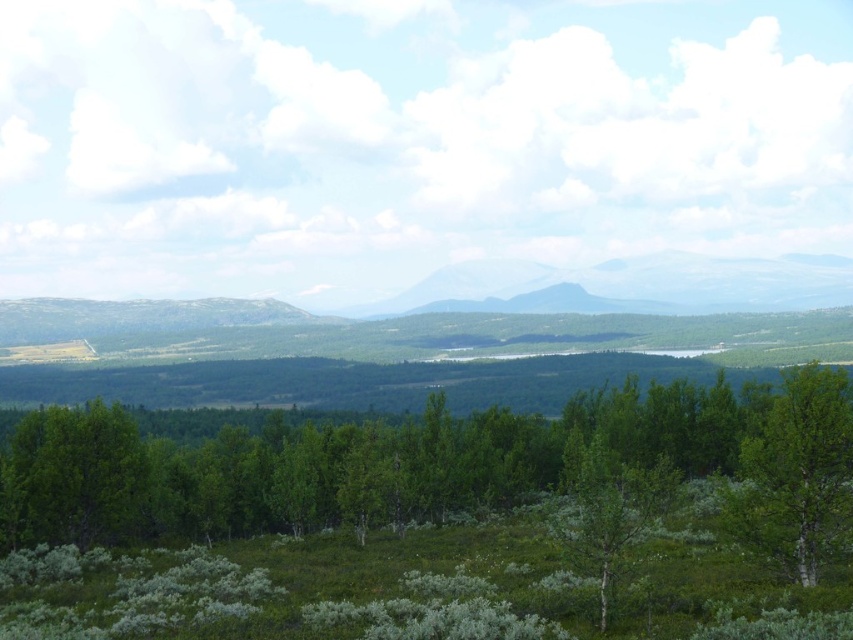
Question: Considering the relative positions of green leafy tree at right and green leafy tree at lower left in the image provided, where is green leafy tree at right located with respect to green leafy tree at lower left?

Choices:
 (A) below
 (B) above

Answer: (B)

Question: Considering the real-world distances, which object is closest to the green matte tree at center?

Choices:
 (A) green leafy tree at right
 (B) green leafy tree at lower left

Answer: (A)

Question: Does green leafy tree at right lie in front of green matte tree at center?

Choices:
 (A) no
 (B) yes

Answer: (A)

Question: Does green leafy tree at lower left appear on the left side of green matte tree at center?

Choices:
 (A) yes
 (B) no

Answer: (A)

Question: Which object is closer to the camera taking this photo?

Choices:
 (A) green leafy tree at right
 (B) green leafy tree at lower left
 (C) green leafy trees at center

Answer: (C)

Question: Which object appears farthest from the camera in this image?

Choices:
 (A) green leafy tree at right
 (B) green leafy trees at center
 (C) green matte tree at center
 (D) green leafy tree at lower left

Answer: (D)